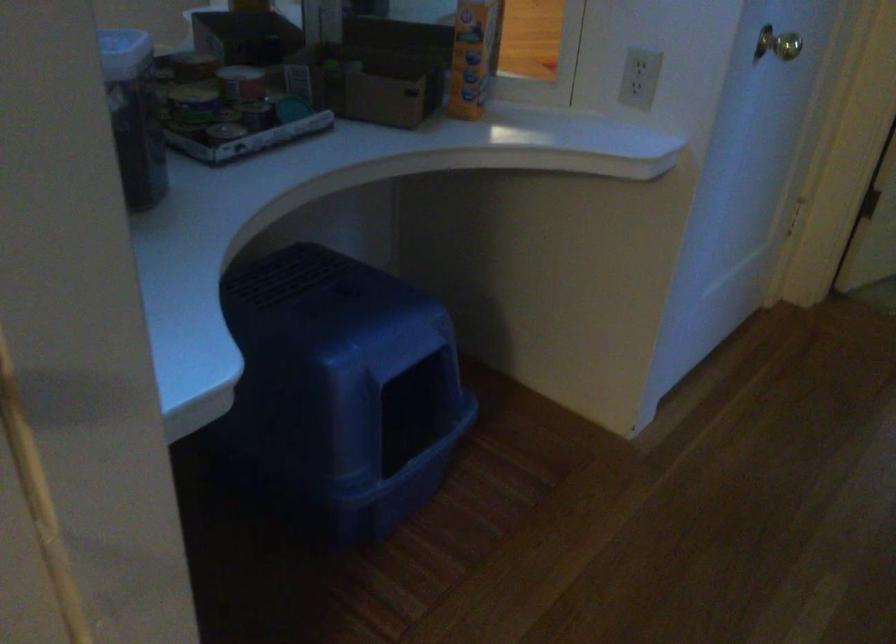
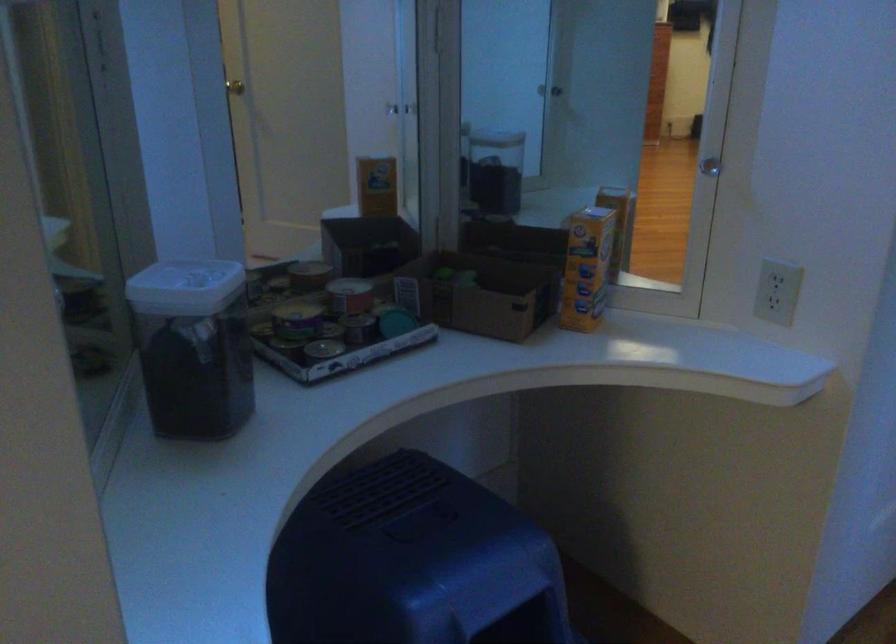
Question: How did the camera likely rotate?

Choices:
 (A) Left
 (B) Right
 (C) Up
 (D) Down

Answer: (A)